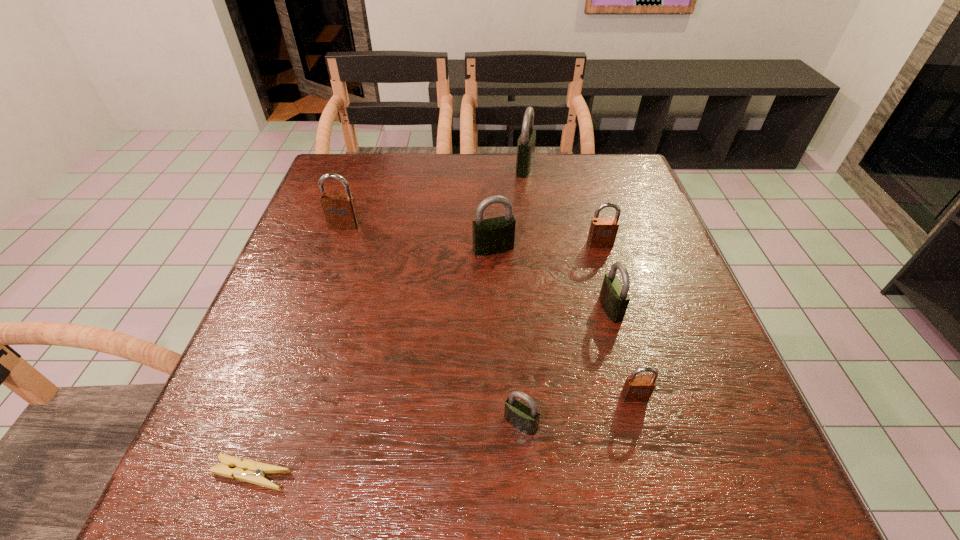
In the image, there is a desktop. Find the location of `vacant region at the right edge`. vacant region at the right edge is located at coordinates (691, 355).

Where is `free space at the far left corner`? The image size is (960, 540). free space at the far left corner is located at coordinates (360, 193).

Locate an element on the screen. Image resolution: width=960 pixels, height=540 pixels. free area in between the rightmost black padlock and the seventh nearest object is located at coordinates (477, 267).

The image size is (960, 540). I want to click on empty space that is in between the smallest black padlock and the fourth nearest object, so click(565, 366).

At what (x,y) coordinates should I click in order to perform the action: click on empty location between the sixth farthest object and the nearest padlock. Please return your answer as a coordinate pair (x, y). Looking at the image, I should click on (578, 410).

Locate an element on the screen. This screenshot has height=540, width=960. free point between the nearest black padlock and the second farthest black padlock is located at coordinates (507, 336).

Locate an element on the screen. Image resolution: width=960 pixels, height=540 pixels. empty space between the nearest object and the leftmost brown padlock is located at coordinates (299, 349).

This screenshot has height=540, width=960. I want to click on empty location between the rightmost black padlock and the sixth nearest padlock, so click(x=477, y=267).

The height and width of the screenshot is (540, 960). Find the location of `free spot between the smallest brown padlock and the fourth padlock from right to left`. free spot between the smallest brown padlock and the fourth padlock from right to left is located at coordinates (580, 282).

The width and height of the screenshot is (960, 540). Identify the location of empty location between the third nearest padlock and the third nearest object. (622, 353).